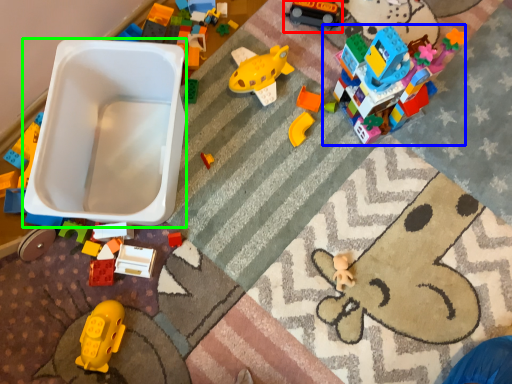
Question: Which object is the farthest from toy (highlighted by a red box)? Choose among these: toy (highlighted by a blue box) or toy car (highlighted by a green box).

Choices:
 (A) toy
 (B) toy car

Answer: (B)